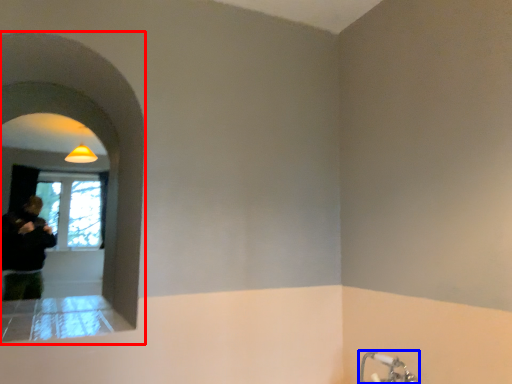
Question: Which point is closer to the camera, archway (highlighted by a red box) or tap (highlighted by a blue box)?

Choices:
 (A) archway
 (B) tap

Answer: (A)